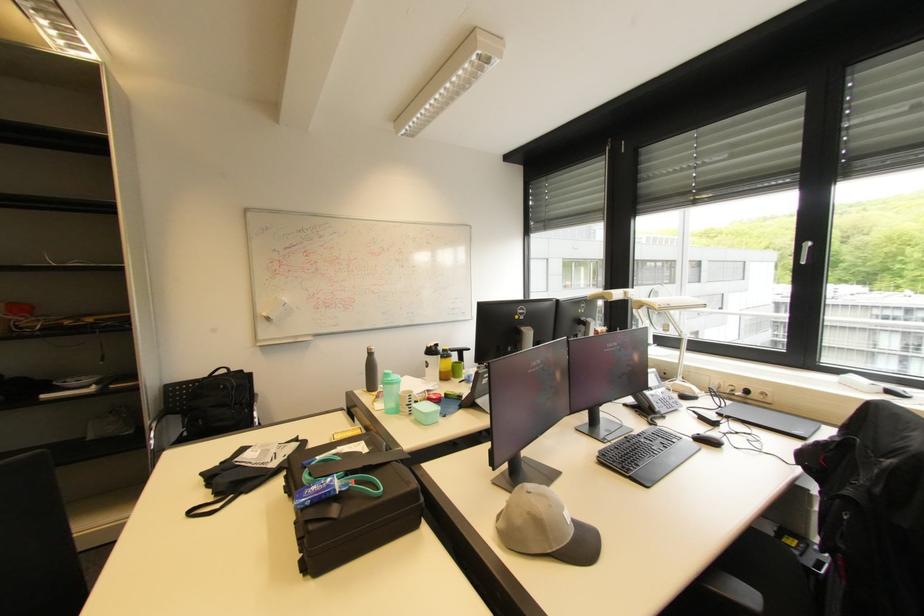
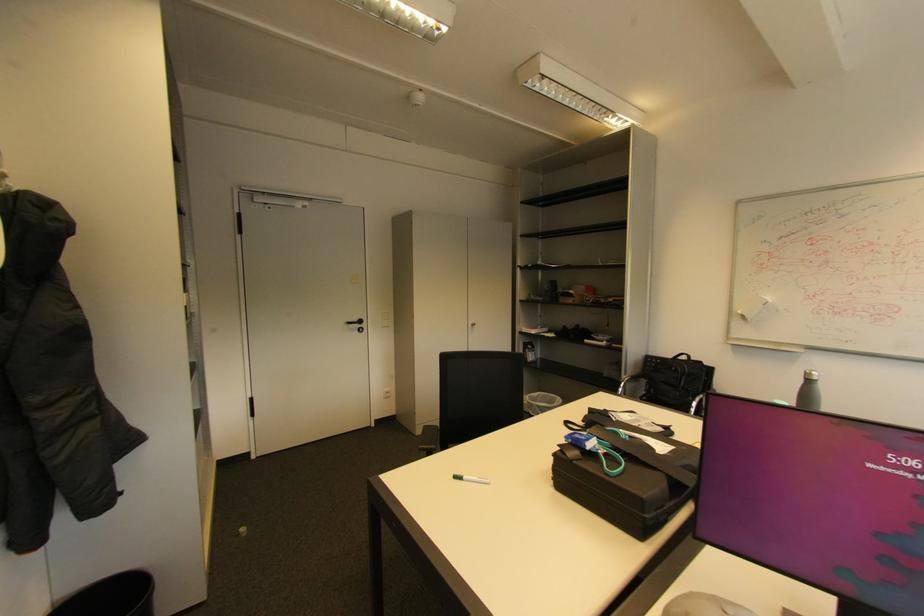
Question: The camera is either moving clockwise (left) or counter-clockwise (right) around the object. The first image is from the beginning of the video and the second image is from the end. Is the camera moving left or right when shooting the video?

Choices:
 (A) Left
 (B) Right

Answer: (B)